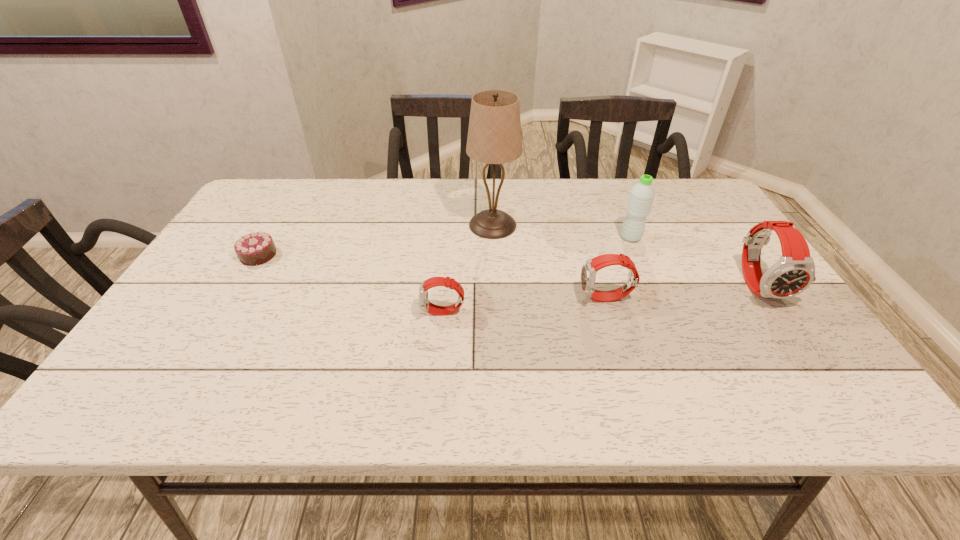
Find the location of a particular element. This screenshot has height=540, width=960. the second shortest object is located at coordinates (424, 304).

You are a GUI agent. You are given a task and a screenshot of the screen. Output one action in this format:
    pyautogui.click(x=<x>, y=<y>)
    Task: Click on the shortest watch
    
    Given the screenshot: What is the action you would take?
    pyautogui.click(x=424, y=304)

This screenshot has width=960, height=540. I want to click on the third object from right to left, so click(589, 269).

In order to click on the third shortest object in this screenshot , I will do `click(589, 269)`.

Identify the location of the rightmost object. (x=794, y=272).

In order to click on the rightmost watch in this screenshot , I will do `click(794, 272)`.

This screenshot has width=960, height=540. Find the location of `water bottle`. water bottle is located at coordinates (642, 194).

Where is `the shortest object`? the shortest object is located at coordinates (257, 248).

In order to click on the leftmost object in this screenshot , I will do `click(257, 248)`.

Where is `the tallest object`? The height and width of the screenshot is (540, 960). the tallest object is located at coordinates (494, 137).